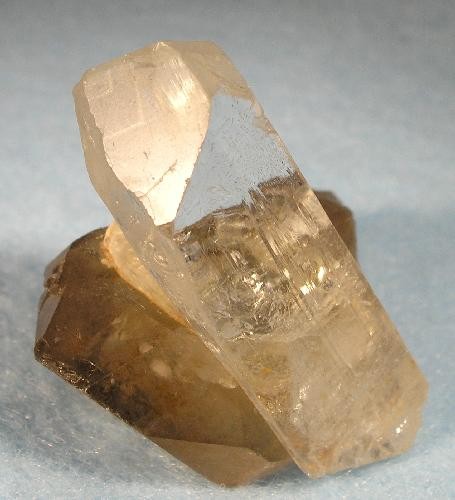
Locate an element on the screen. countertop is located at coordinates (50, 444).